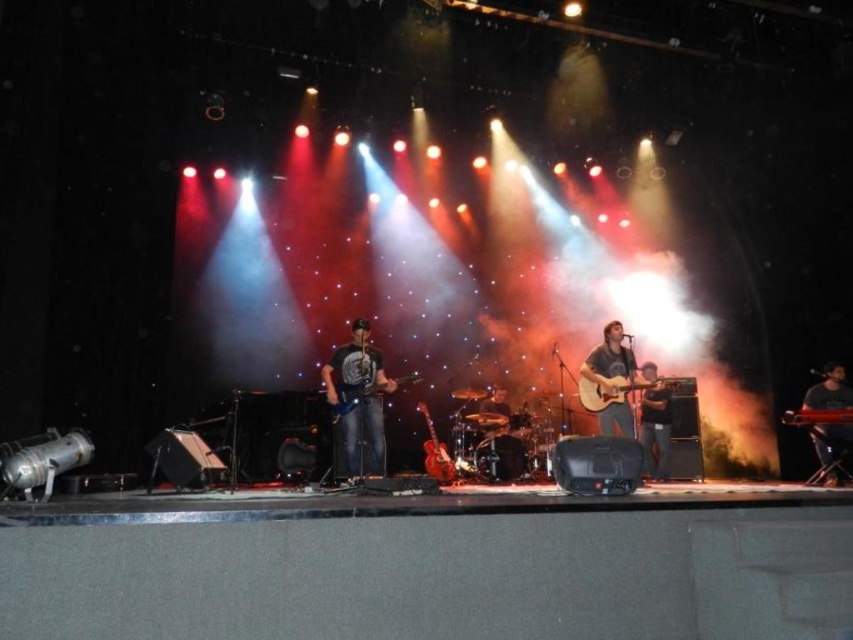
Question: Which object is positioned closest to the matte black guitar at center?

Choices:
 (A) shiny black guitar at center
 (B) glossy wood guitar at center
 (C) matte brown guitar at center

Answer: (C)

Question: Which point is closer to the camera taking this photo?

Choices:
 (A) (506, 445)
 (B) (630, 362)
 (C) (440, 461)
 (D) (643, 429)

Answer: (B)

Question: Is shiny black guitar at center behind shiny brown electric guitar at center?

Choices:
 (A) no
 (B) yes

Answer: (A)

Question: Which object is closer to the camera taking this photo?

Choices:
 (A) matte black t-shirt at center
 (B) shiny black guitar at center
 (C) metallic silver guitar at center
 (D) acoustic wood guitar at center

Answer: (B)

Question: Can you confirm if glossy wood guitar at center is bigger than metallic silver guitar at center?

Choices:
 (A) no
 (B) yes

Answer: (B)

Question: Is shiny black guitar at center bigger than glossy wood guitar at center?

Choices:
 (A) yes
 (B) no

Answer: (A)